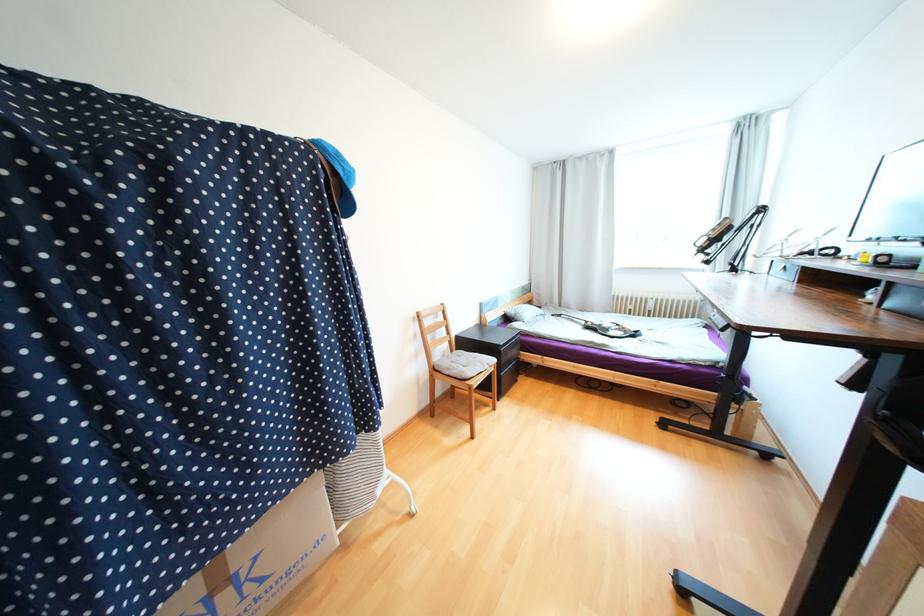
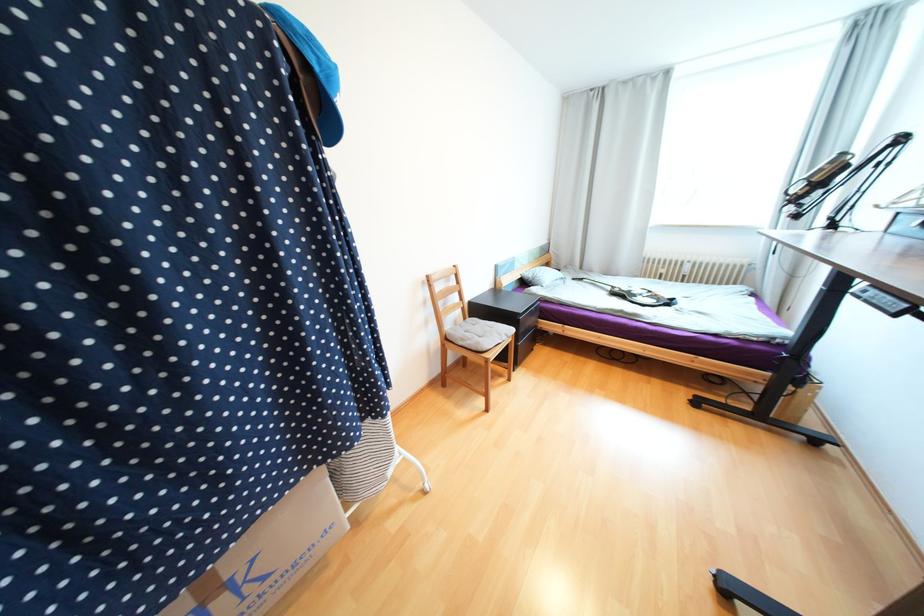
Locate, in the second image, the point that corresponds to [317,474] in the first image.

(314, 471)